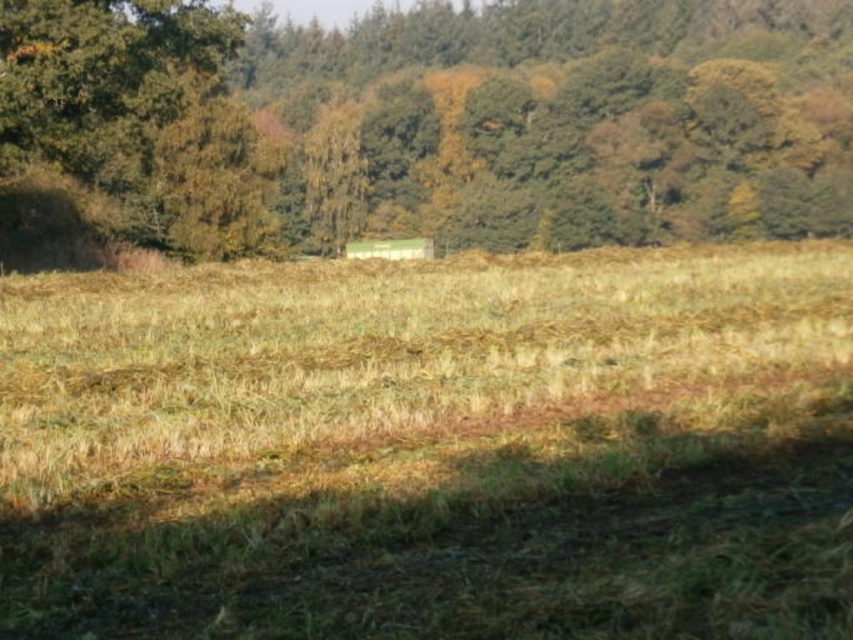
Who is positioned more to the left, dry grass at center or green leafy tree at upper center?

From the viewer's perspective, dry grass at center appears more on the left side.

Is dry grass at center taller than green leafy tree at upper center?

No.

Which is in front, point (505, 417) or point (344, 106)?

Point (505, 417)

Image resolution: width=853 pixels, height=640 pixels. I want to click on dry grass at center, so click(432, 449).